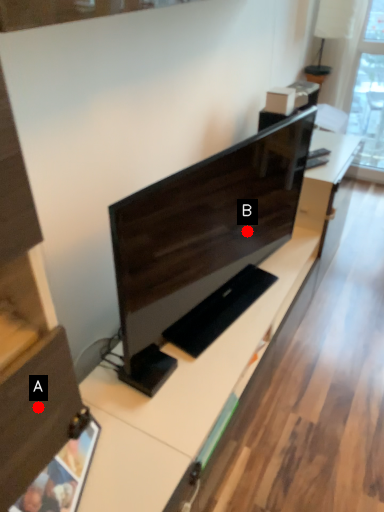
Question: Two points are circled on the image, labeled by A and B beside each circle. Which point appears closest to the camera in this image?

Choices:
 (A) A is closer
 (B) B is closer

Answer: (A)